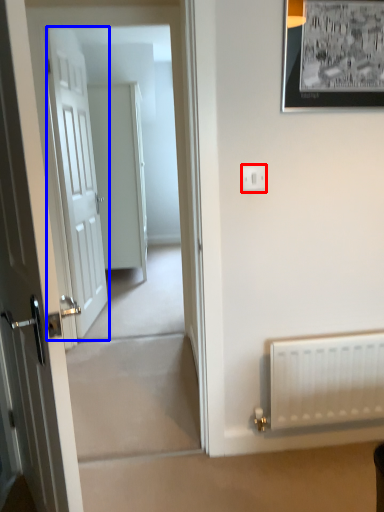
Question: Among these objects, which one is nearest to the camera, electric outlet (highlighted by a red box) or door (highlighted by a blue box)?

Choices:
 (A) electric outlet
 (B) door

Answer: (A)